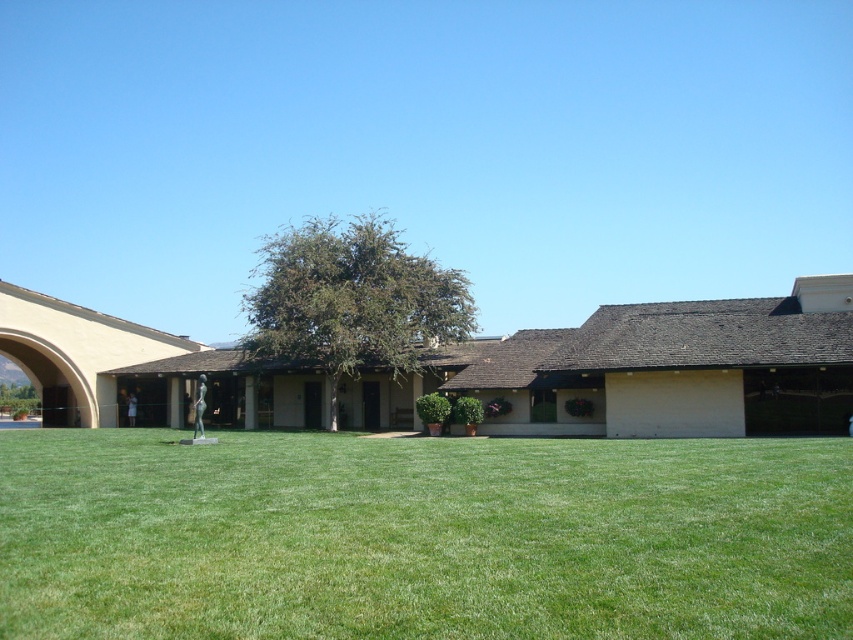
You are standing at the center of the image and want to walk towards the green grass at center. According to the coordinates provided, in which direction should you move?

The green grass at center is located at point 0.839 on the x and 0.496 on the y. Since you are at the center, which is typically at coordinates around 0.5, you should move to the right and slightly downward to reach it.

You are standing at the point marked by coordinates point [422,536] in the image. What is the name of the object you are currently standing on?

The point [422,536] marks green grass at center, so you are standing on the green grass at center.